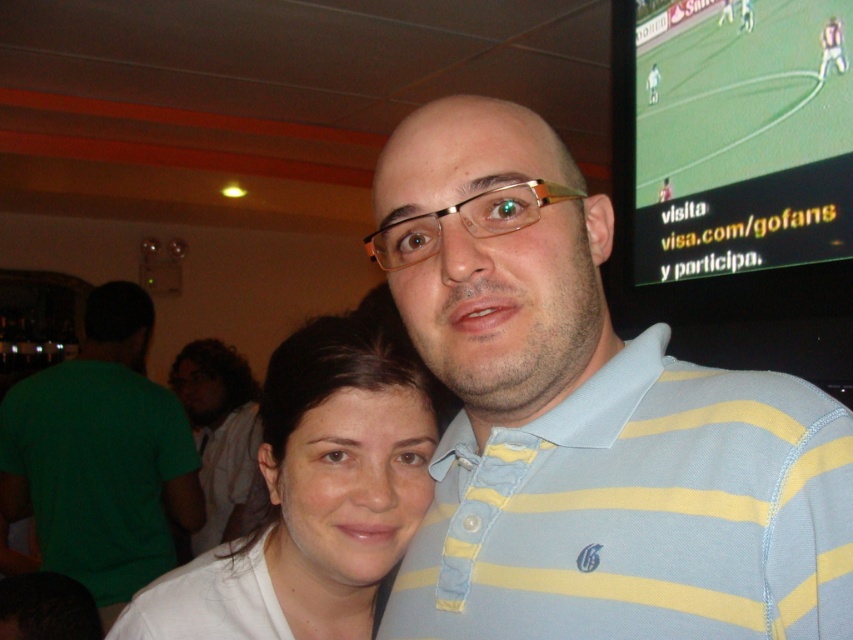
Does green cotton shirt at left appear under light brown hair at center?

Incorrect, green cotton shirt at left is not positioned below light brown hair at center.

Who is more forward, (132, 538) or (222, 532)?

Point (132, 538) is in front.

This screenshot has width=853, height=640. Find the location of `green cotton shirt at left`. green cotton shirt at left is located at coordinates (102, 456).

How far apart are white fabric shirt at center and green cotton shirt at left?

white fabric shirt at center is 1.97 meters from green cotton shirt at left.

Image resolution: width=853 pixels, height=640 pixels. What do you see at coordinates (312, 499) in the screenshot?
I see `white fabric shirt at center` at bounding box center [312, 499].

Between point (346, 384) and point (120, 506), which one is positioned behind?

The point (120, 506) is behind.

Find the location of a particular element. The image size is (853, 640). white fabric shirt at center is located at coordinates (312, 499).

Can you confirm if light blue striped polo shirt at center is bigger than green cotton shirt at left?

No.

Is light blue striped polo shirt at center positioned in front of green cotton shirt at left?

Yes, it is.

Where is `light blue striped polo shirt at center`? This screenshot has height=640, width=853. light blue striped polo shirt at center is located at coordinates (589, 420).

Identify the location of light blue striped polo shirt at center. The height and width of the screenshot is (640, 853). (589, 420).